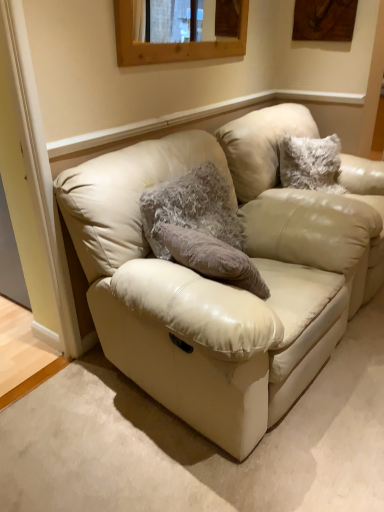
Question: Would you say beige leather swivel chair at center is inside or outside wooden frame at upper center?

Choices:
 (A) inside
 (B) outside

Answer: (B)

Question: Considering the relative positions of beige leather swivel chair at center and wooden frame at upper center in the image provided, is beige leather swivel chair at center to the left or to the right of wooden frame at upper center?

Choices:
 (A) right
 (B) left

Answer: (A)

Question: Estimate the real-world distances between objects in this image. Which object is farther from the beige leather couch at center?

Choices:
 (A) fuzzy gray pillow at center
 (B) wooden frame at upper center
 (C) beige leather swivel chair at center

Answer: (B)

Question: Which object is the closest to the wooden frame at upper center?

Choices:
 (A) fuzzy gray pillow at center
 (B) beige leather swivel chair at center
 (C) beige leather couch at center

Answer: (B)